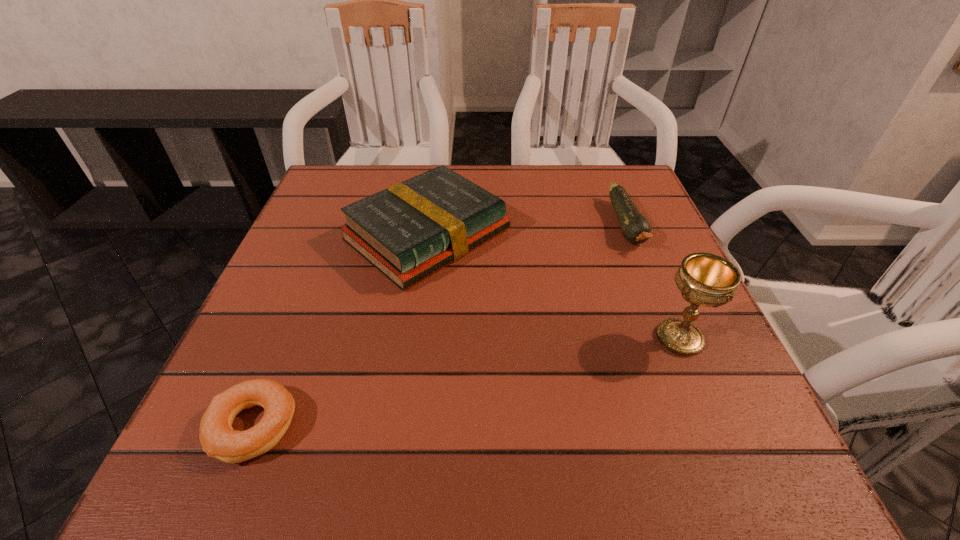
At what (x,y) coordinates should I click in order to perform the action: click on free region that satisfies the following two spatial constraints: 1. at the blossom end of the zucchini; 2. on the right side of the tallest object. Please return your answer as a coordinate pair (x, y). The width and height of the screenshot is (960, 540). Looking at the image, I should click on (673, 338).

Where is `blank space that satisfies the following two spatial constraints: 1. at the blossom end of the zucchini; 2. on the left side of the second nearest object`? The height and width of the screenshot is (540, 960). blank space that satisfies the following two spatial constraints: 1. at the blossom end of the zucchini; 2. on the left side of the second nearest object is located at coordinates (673, 338).

Locate an element on the screen. free space that satisfies the following two spatial constraints: 1. at the blossom end of the chalice; 2. on the right side of the zucchini is located at coordinates (673, 338).

Find the location of a particular element. vacant space that satisfies the following two spatial constraints: 1. at the blossom end of the third tallest object; 2. on the left side of the chalice is located at coordinates (673, 338).